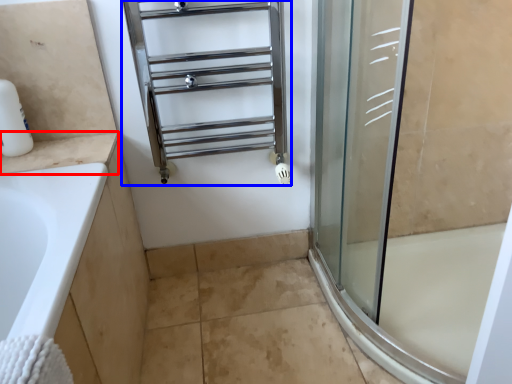
Question: Which object appears closest to the camera in this image, counter top (highlighted by a red box) or shelf (highlighted by a blue box)?

Choices:
 (A) counter top
 (B) shelf

Answer: (B)